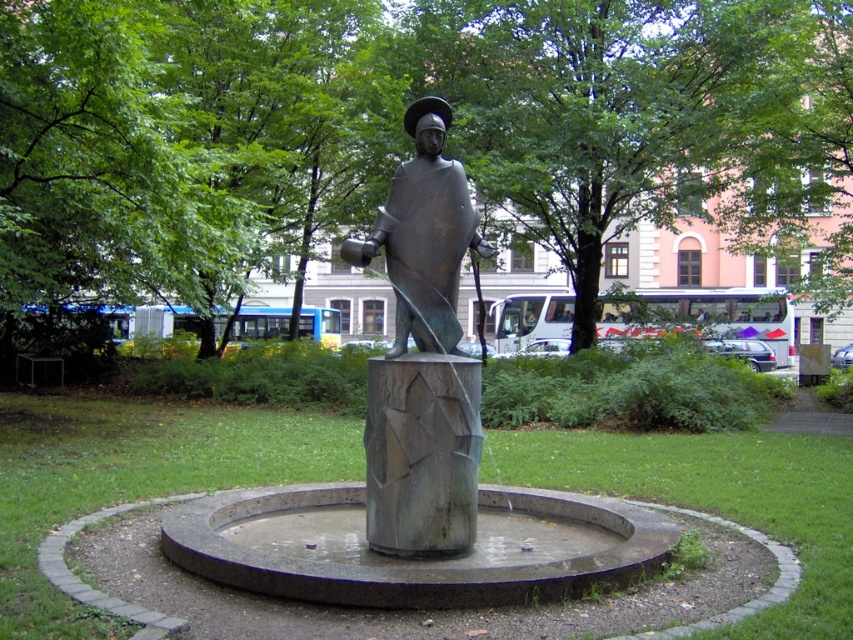
Is point (834, 172) farther from camera compared to point (418, 104)?

Yes, point (834, 172) is behind point (418, 104).

Is the position of green leafy tree at center more distant than that of bronze statue at center?

Yes, green leafy tree at center is behind bronze statue at center.

Where is `green leafy tree at center`? Image resolution: width=853 pixels, height=640 pixels. green leafy tree at center is located at coordinates (399, 131).

At what (x,y) coordinates should I click in order to perform the action: click on green leafy tree at center. Please return your answer as a coordinate pair (x, y). Looking at the image, I should click on (399, 131).